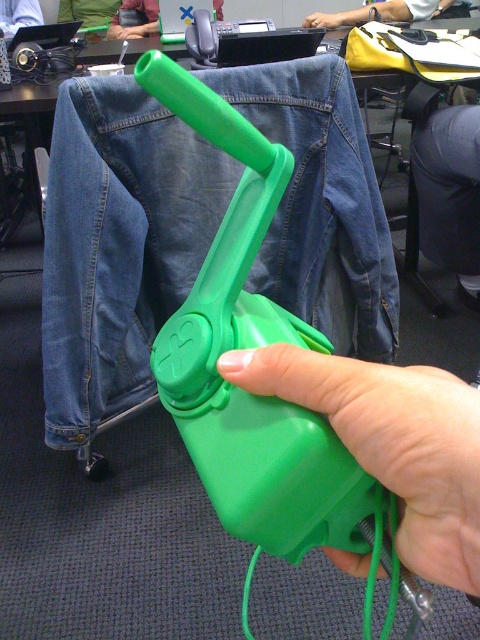
You are organizing a presentation and need to place the smooth yellow shirt at upper center on a desk. Given its position in the image, which direction should you move it to align it with the center of the desk?

The smooth yellow shirt at upper center is already positioned at the center of the desk since its coordinates are at point (384, 12), which is near the center point.

You are organizing an office event and need to place the smooth yellow shirt at upper center and the brushed metal water at bottle left on a shelf. Which object should you place first to ensure proper positioning according to their spatial relationship?

The smooth yellow shirt at upper center should be placed first because it needs to be positioned below the brushed metal water at bottle left.

You are standing in an office and see two points marked in the image. Which point, point [410,13] or point [10,1], is closer to you?

Point [410,13] is closer to the viewer than point [10,1].